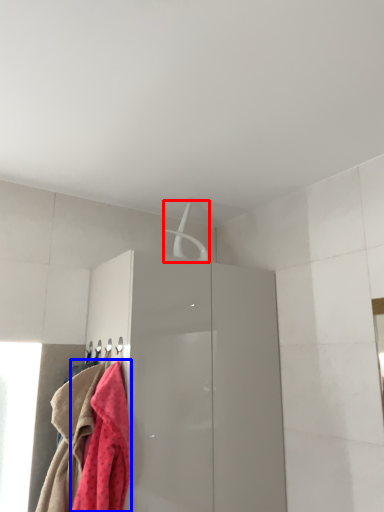
Question: Which object is closer to the camera taking this photo, hanger (highlighted by a red box) or towel (highlighted by a blue box)?

Choices:
 (A) hanger
 (B) towel

Answer: (B)